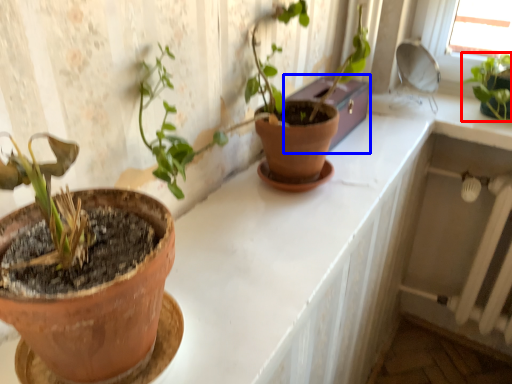
Question: Which object appears closest to the camera in this image, houseplant (highlighted by a red box) or window box (highlighted by a blue box)?

Choices:
 (A) houseplant
 (B) window box

Answer: (B)